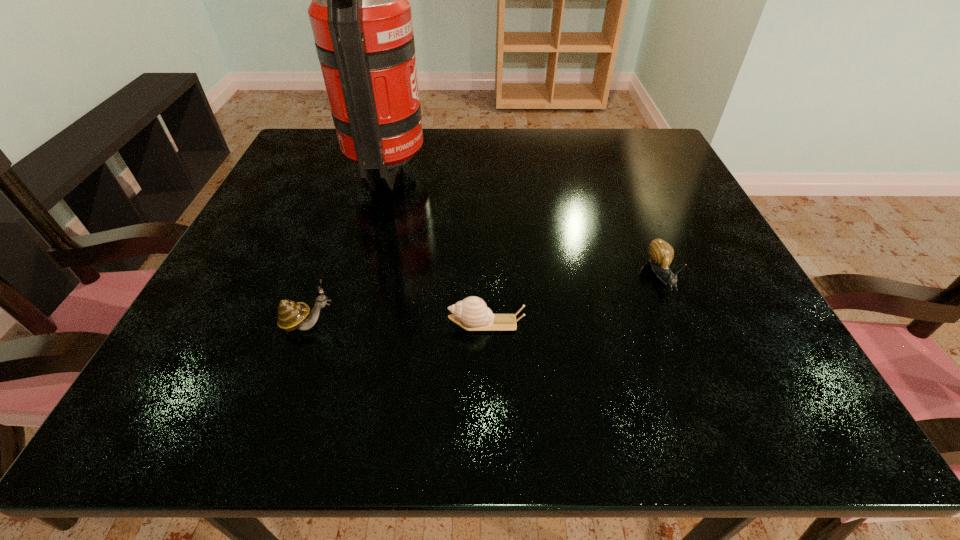
Identify the location of vacant space that satisfies the following two spatial constraints: 1. on the front-facing side of the second farthest object; 2. on the face of the tallest escargot. (682, 325).

This screenshot has height=540, width=960. I want to click on free point that satisfies the following two spatial constraints: 1. on the front-facing side of the farthest escargot; 2. on the shell of the second escargot from left to right, so click(x=682, y=323).

Find the location of `blank area in the image that satisfies the following two spatial constraints: 1. on the front-facing side of the farthest escargot; 2. on the face of the leftmost escargot`. blank area in the image that satisfies the following two spatial constraints: 1. on the front-facing side of the farthest escargot; 2. on the face of the leftmost escargot is located at coordinates (682, 325).